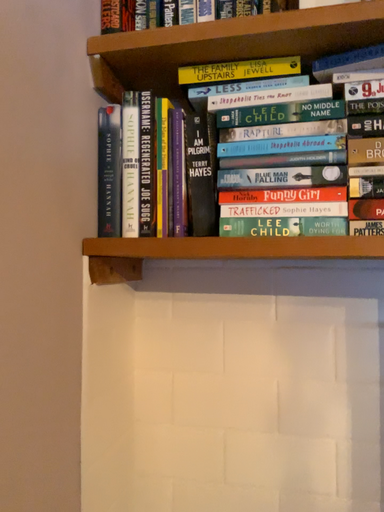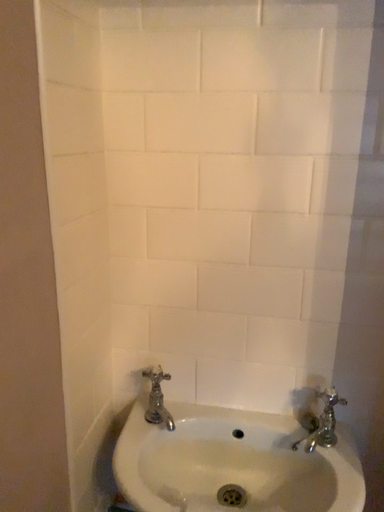
Question: Which way did the camera rotate in the video?

Choices:
 (A) rotated downward
 (B) rotated upward

Answer: (A)